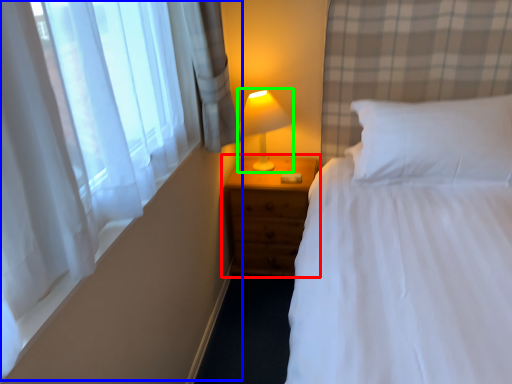
Question: Considering the real-world distances, which object is farthest from nightstand (highlighted by a red box)? curtain (highlighted by a blue box) or lamp (highlighted by a green box)?

Choices:
 (A) curtain
 (B) lamp

Answer: (A)